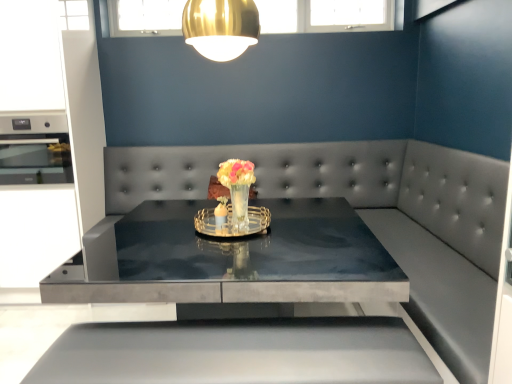
Question: Relative to translucent glass vase at center, which is the first floral arrangement from back to front, is smooth gray couch at center in front or behind?

Choices:
 (A) front
 (B) behind

Answer: (A)

Question: From a real-world perspective, relative to translucent glass vase at center, positioned as the 2th floral arrangement in front-to-back order, is smooth gray couch at center vertically above or below?

Choices:
 (A) below
 (B) above

Answer: (A)

Question: Which of these objects is positioned farthest from the translucent glass vase at center, placed as the 1th floral arrangement when sorted from front to back?

Choices:
 (A) matte black oven at left
 (B) translucent glass vase at center, positioned as the 2th floral arrangement in front-to-back order
 (C) gold metallic lampshade at upper center
 (D) smooth gray couch at center

Answer: (A)

Question: Which is farther from the smooth gray couch at center?

Choices:
 (A) matte black oven at left
 (B) translucent glass vase at center, positioned as the 2th floral arrangement in front-to-back order
 (C) gold metallic lampshade at upper center
 (D) translucent glass vase at center, placed as the 1th floral arrangement when sorted from front to back

Answer: (A)